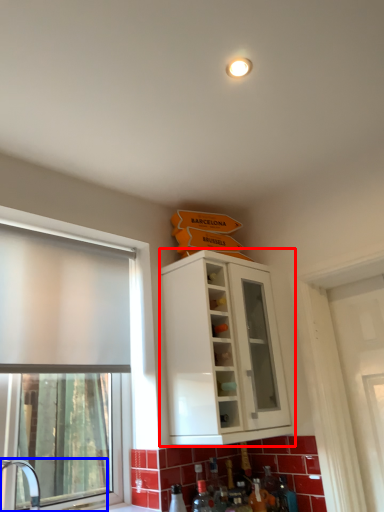
Question: Among these objects, which one is nearest to the camera, cabinetry (highlighted by a red box) or sink (highlighted by a blue box)?

Choices:
 (A) cabinetry
 (B) sink

Answer: (B)